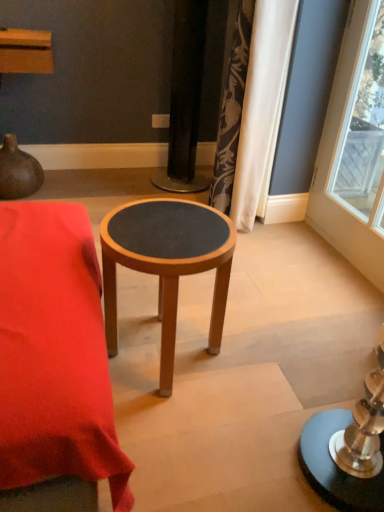
Question: Should I look upward or downward to see wooden stool at center?

Choices:
 (A) down
 (B) up

Answer: (A)

Question: Does silky floral curtain at upper right turn towards wooden stool at center?

Choices:
 (A) yes
 (B) no

Answer: (B)

Question: Can you confirm if silky floral curtain at upper right is shorter than wooden stool at center?

Choices:
 (A) yes
 (B) no

Answer: (B)

Question: Can you confirm if silky floral curtain at upper right is wider than wooden stool at center?

Choices:
 (A) no
 (B) yes

Answer: (A)

Question: Is silky floral curtain at upper right taller than wooden stool at center?

Choices:
 (A) no
 (B) yes

Answer: (B)

Question: Is silky floral curtain at upper right surrounding wooden stool at center?

Choices:
 (A) no
 (B) yes

Answer: (A)

Question: Is silky floral curtain at upper right to the right of wooden stool at center from the viewer's perspective?

Choices:
 (A) no
 (B) yes

Answer: (B)

Question: Is wooden stool at center positioned in front of silky floral curtain at upper right?

Choices:
 (A) no
 (B) yes

Answer: (B)

Question: Are wooden stool at center and silky floral curtain at upper right far apart?

Choices:
 (A) yes
 (B) no

Answer: (A)

Question: Can you confirm if wooden stool at center is shorter than silky floral curtain at upper right?

Choices:
 (A) yes
 (B) no

Answer: (A)

Question: Is wooden stool at center facing away from silky floral curtain at upper right?

Choices:
 (A) no
 (B) yes

Answer: (A)

Question: Considering the relative sizes of wooden stool at center and silky floral curtain at upper right in the image provided, is wooden stool at center wider than silky floral curtain at upper right?

Choices:
 (A) no
 (B) yes

Answer: (B)

Question: Does wooden stool at center appear on the left side of silky floral curtain at upper right?

Choices:
 (A) yes
 (B) no

Answer: (A)

Question: Does wooden stool at center have a lesser height compared to silky floral curtain at upper right?

Choices:
 (A) no
 (B) yes

Answer: (B)